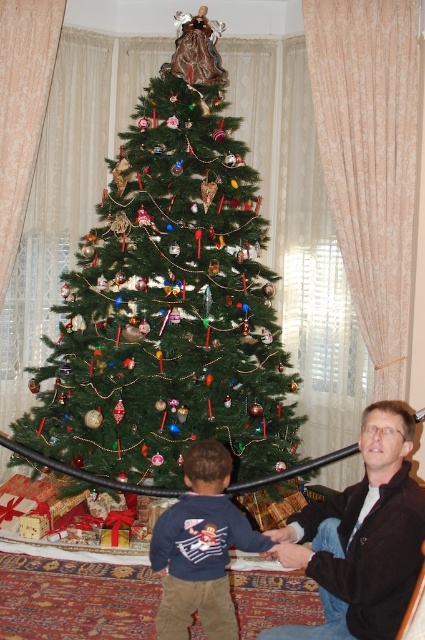
Who is positioned more to the left, green matte christmas tree at center or dark brown leather jacket at lower right?

green matte christmas tree at center

Where is `green matte christmas tree at center`? green matte christmas tree at center is located at coordinates (170, 301).

Which is above, green matte christmas tree at center or dark blue sweater at lower center?

green matte christmas tree at center

Which is more to the left, green matte christmas tree at center or dark blue sweater at lower center?

green matte christmas tree at center

Between point (221, 296) and point (224, 616), which one is positioned in front?

Point (224, 616) is more forward.

Locate an element on the screen. green matte christmas tree at center is located at coordinates (170, 301).

Is point (326, 564) positioned after point (167, 515)?

No, (326, 564) is closer to viewer.

Between dark brown leather jacket at lower right and dark blue sweater at lower center, which one has more height?

dark brown leather jacket at lower right

This screenshot has width=425, height=640. Find the location of `dark brown leather jacket at lower right`. dark brown leather jacket at lower right is located at coordinates (360, 538).